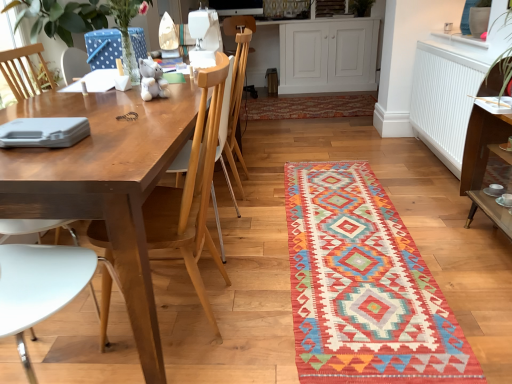
Where is `vacant area located to the right-hand side of wooden chair at center`? This screenshot has width=512, height=384. vacant area located to the right-hand side of wooden chair at center is located at coordinates (273, 177).